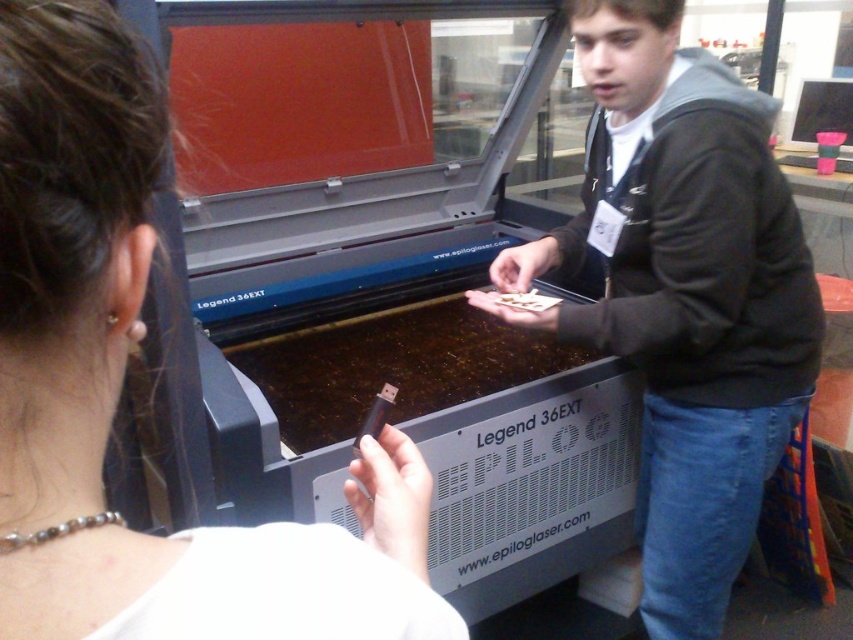
Question: Which point is farther to the camera?

Choices:
 (A) dark gray hoodie at center
 (B) matte black usb drive at center

Answer: (A)

Question: Among these objects, which one is nearest to the camera?

Choices:
 (A) dark gray hoodie at center
 (B) matte black usb drive at center

Answer: (B)

Question: Does matte black usb drive at center come behind dark gray hoodie at center?

Choices:
 (A) no
 (B) yes

Answer: (A)

Question: Which of the following is the closest to the observer?

Choices:
 (A) matte black usb drive at center
 (B) dark gray hoodie at center

Answer: (A)

Question: Is matte black usb drive at center wider than dark gray hoodie at center?

Choices:
 (A) yes
 (B) no

Answer: (B)

Question: Can you confirm if matte black usb drive at center is wider than dark gray hoodie at center?

Choices:
 (A) no
 (B) yes

Answer: (A)